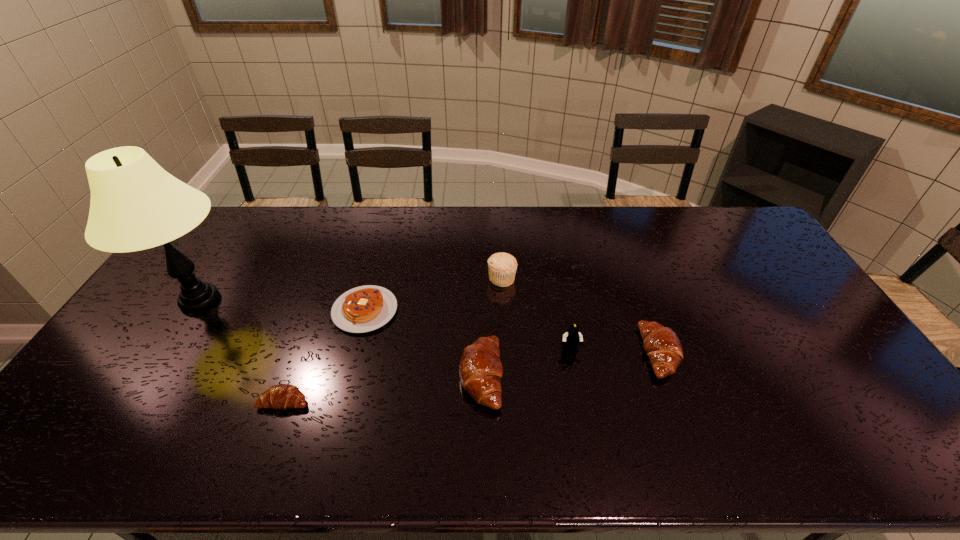
Where is `empty location between the pancake and the rightmost crescent roll`? This screenshot has height=540, width=960. empty location between the pancake and the rightmost crescent roll is located at coordinates (513, 332).

At what (x,y) coordinates should I click in order to perform the action: click on free spot between the second object from right to left and the muffin. Please return your answer as a coordinate pair (x, y). Looking at the image, I should click on (536, 314).

Select which object appears as the third closest to the third shortest object. Please provide its 2D coordinates. Your answer should be formatted as a tuple, i.e. [(x, y)], where the tuple contains the x and y coordinates of a point satisfying the conditions above.

[(480, 369)]

Find the location of a particular element. The image size is (960, 540). object that stands as the fourth closest to the shortest crescent roll is located at coordinates (502, 267).

Where is `the third closest crescent roll to the pancake`? the third closest crescent roll to the pancake is located at coordinates (661, 344).

Select which crescent roll is the closest to the pancake. Please provide its 2D coordinates. Your answer should be formatted as a tuple, i.e. [(x, y)], where the tuple contains the x and y coordinates of a point satisfying the conditions above.

[(281, 396)]

I want to click on vacant region that satisfies the following two spatial constraints: 1. on the back side of the leftmost crescent roll; 2. on the left side of the second crescent roll from right to left, so click(x=294, y=375).

Where is `blank area in the image that satisfies the following two spatial constraints: 1. on the front side of the leftmost crescent roll; 2. on the left side of the lamp`? blank area in the image that satisfies the following two spatial constraints: 1. on the front side of the leftmost crescent roll; 2. on the left side of the lamp is located at coordinates (135, 401).

In order to click on vacant space that satisfies the following two spatial constraints: 1. on the front side of the muffin; 2. on the right side of the fifth tallest object in this screenshot , I will do coord(506,353).

The width and height of the screenshot is (960, 540). I want to click on vacant space that satisfies the following two spatial constraints: 1. on the front side of the pancake; 2. on the left side of the second crescent roll from right to left, so click(x=348, y=375).